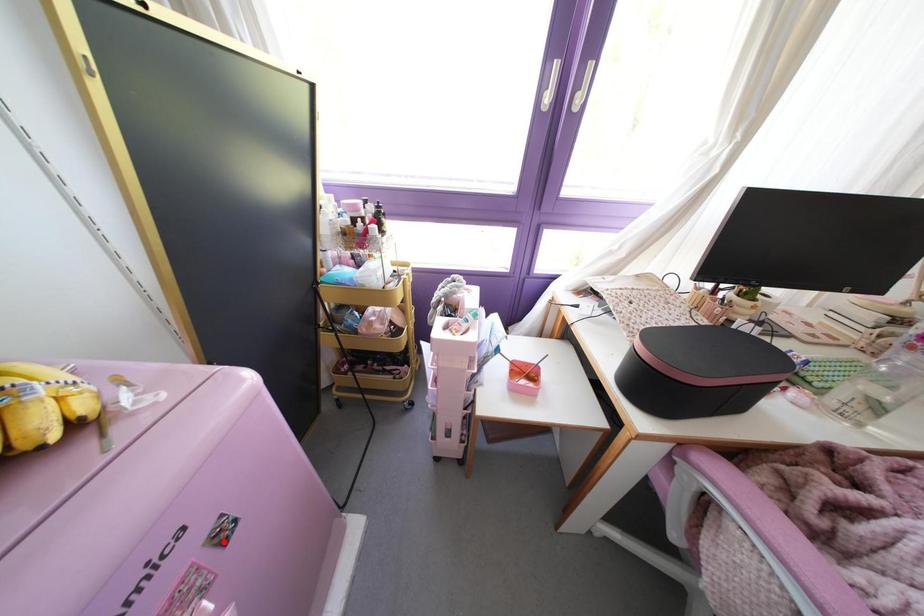
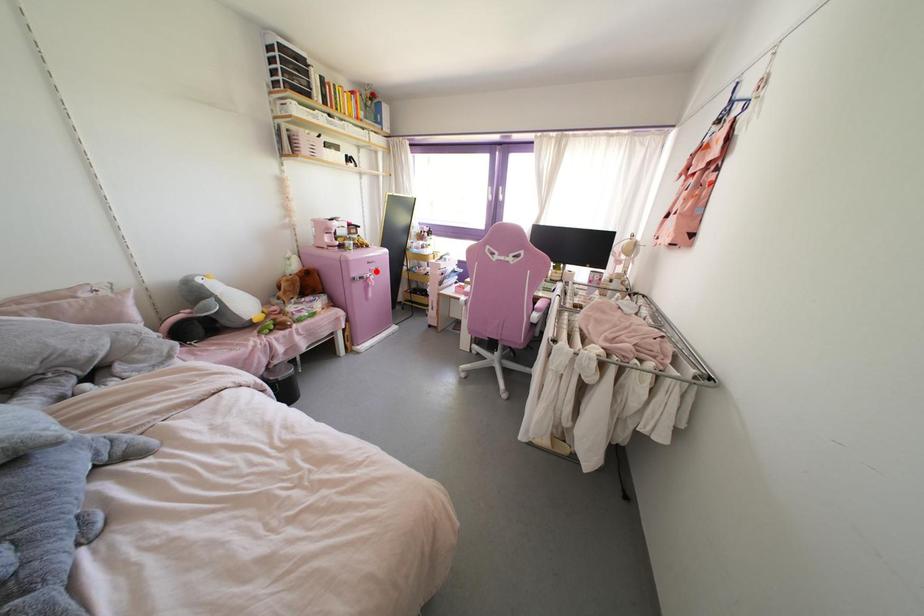
I am providing you with two images of the same scene from different viewpoints. A red point is marked on the first image and another point is marked on the second image. Are the points marked in image1 and image2 representing the same 3D position?

Yes